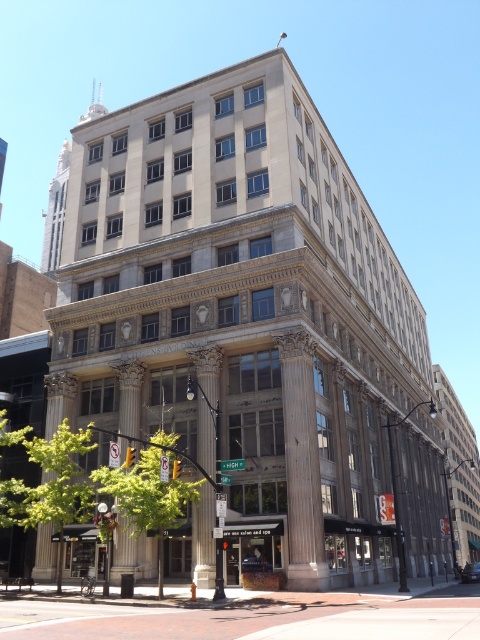
Question: Is smooth stone column at center below polished stone column at center?

Choices:
 (A) no
 (B) yes

Answer: (A)

Question: Among these objects, which one is farthest from the camera?

Choices:
 (A) white marble pillar at center
 (B) brown polished stone column at center
 (C) polished stone column at center

Answer: (A)

Question: Can you confirm if polished stone column at center is positioned below white marble pillar at center?

Choices:
 (A) no
 (B) yes

Answer: (A)

Question: Which of the following is the closest to the observer?

Choices:
 (A) [315, 529]
 (B) [57, 554]
 (C) [216, 436]
 (D) [129, 380]

Answer: (A)

Question: Can you confirm if smooth stone column at center is wider than polished stone column at center?

Choices:
 (A) yes
 (B) no

Answer: (B)

Question: Which of the following is the closest to the observer?

Choices:
 (A) (72, 417)
 (B) (310, 356)
 (C) (122, 417)
 (D) (206, 458)

Answer: (D)